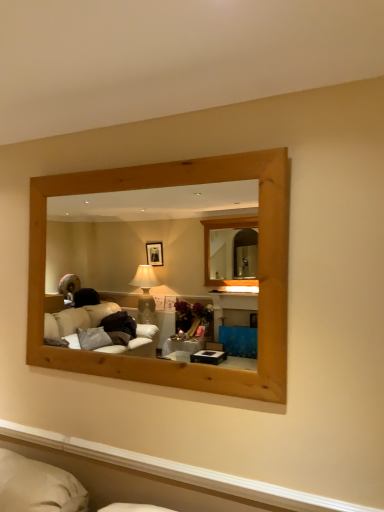
This screenshot has height=512, width=384. What do you see at coordinates (139, 234) in the screenshot?
I see `natural wood mirror at upper center` at bounding box center [139, 234].

You are a GUI agent. You are given a task and a screenshot of the screen. Output one action in this format:
    pyautogui.click(x=<x>, y=<y>)
    Task: Click on the natural wood mirror at upper center
    The height and width of the screenshot is (512, 384).
    Given the screenshot: What is the action you would take?
    pyautogui.click(x=139, y=234)

Find the location of a particular element. natural wood mirror at upper center is located at coordinates (139, 234).